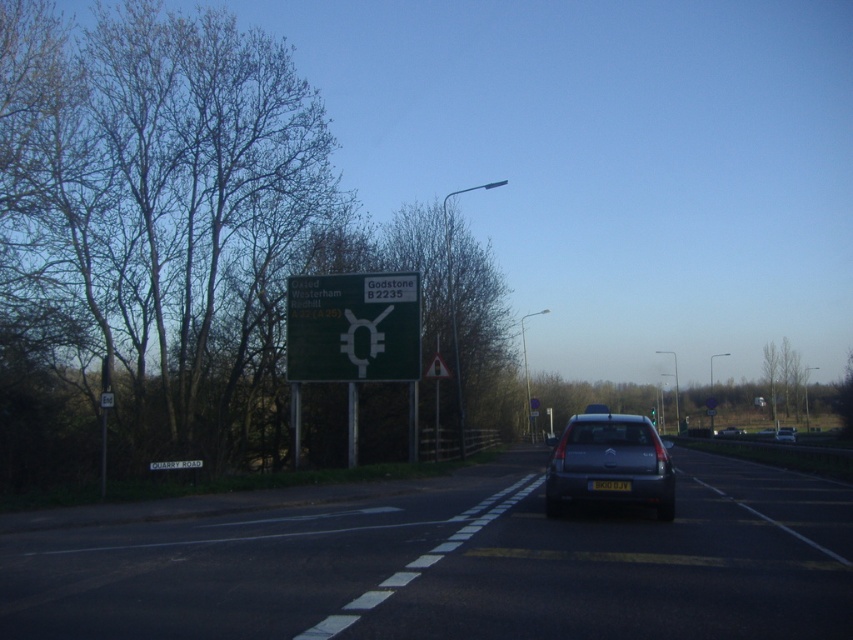
Question: Which object appears farthest from the camera in this image?

Choices:
 (A) matte silver car at center
 (B) bare branches at left
 (C) green matte sign at center
 (D) silver metallic sedan at center

Answer: (D)

Question: Does black asphalt road at center have a lesser width compared to yellow reflective triangle at center?

Choices:
 (A) yes
 (B) no

Answer: (B)

Question: Can you confirm if matte silver car at center is thinner than metallic silver car at center?

Choices:
 (A) yes
 (B) no

Answer: (B)

Question: Considering the real-world distances, which object is closest to the bare branches at left?

Choices:
 (A) silver metallic sedan at center
 (B) yellow reflective triangle at center

Answer: (B)

Question: Which of these objects is positioned farthest from the black asphalt road at center?

Choices:
 (A) black plastic license plate at center
 (B) silver metallic sedan at center

Answer: (B)

Question: Can you confirm if black asphalt road at center is thinner than yellow reflective triangle at center?

Choices:
 (A) no
 (B) yes

Answer: (A)